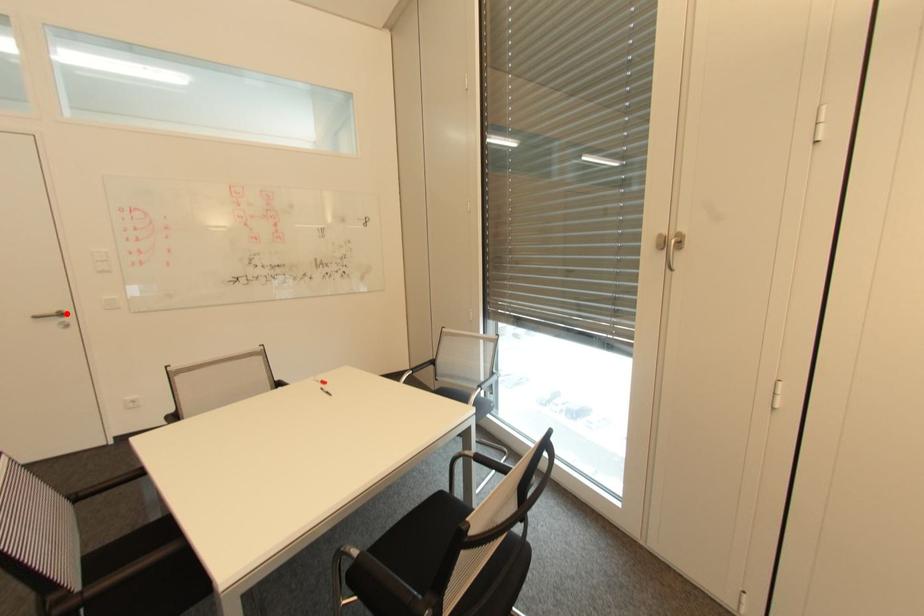
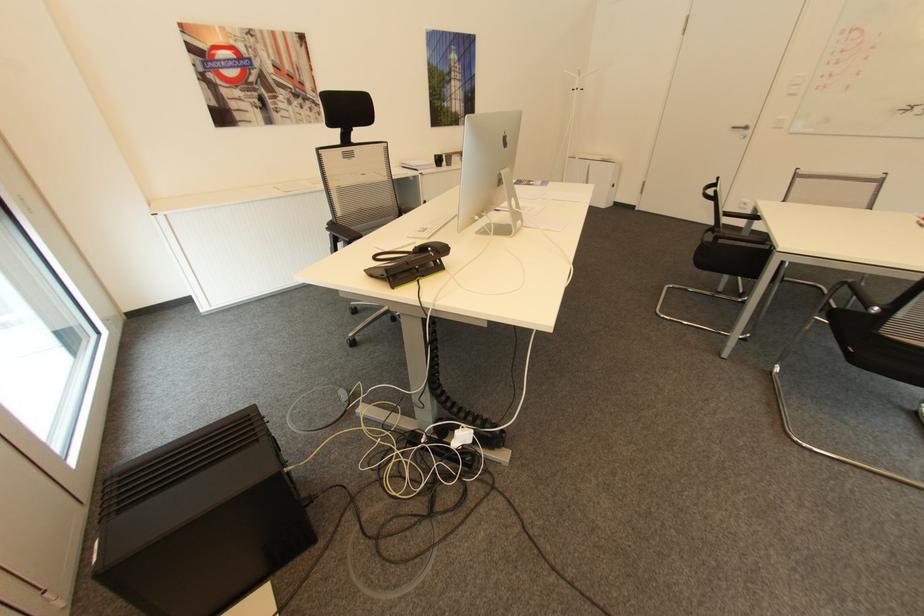
In the second image, find the point that corresponds to the highlighted location in the first image.

(749, 128)